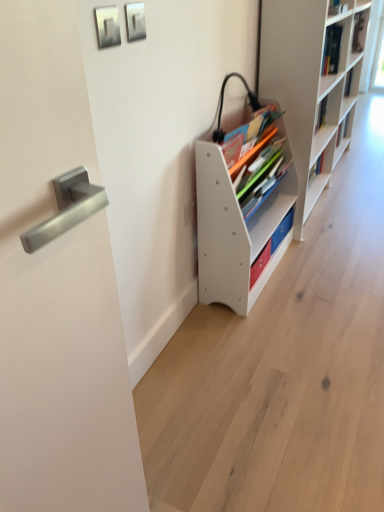
Image resolution: width=384 pixels, height=512 pixels. What do you see at coordinates (238, 224) in the screenshot? I see `white plastic shelf at center, marked as the 2th shelf in a right-to-left arrangement` at bounding box center [238, 224].

Describe the element at coordinates (57, 288) in the screenshot. I see `satin silver handle at left` at that location.

The image size is (384, 512). What do you see at coordinates (258, 166) in the screenshot? I see `matte white bookshelf at center` at bounding box center [258, 166].

Where is `white matte bookshelf at right, placed as the 1th shelf when sorted from right to left`? The width and height of the screenshot is (384, 512). white matte bookshelf at right, placed as the 1th shelf when sorted from right to left is located at coordinates (313, 83).

The height and width of the screenshot is (512, 384). What do you see at coordinates (313, 83) in the screenshot? I see `white matte bookshelf at right, placed as the 1th shelf when sorted from right to left` at bounding box center [313, 83].

Identify the location of metallic silver picture frame at upper center, which is the second picture frame from right to left. (107, 26).

Is the position of satin silver handle at left more distant than that of metallic silver picture frame at upper center, which is the second picture frame from right to left?

No, satin silver handle at left is closer to the viewer.

Does satin silver handle at left turn towards metallic silver picture frame at upper center, which is the second picture frame from right to left?

No, satin silver handle at left is not turned towards metallic silver picture frame at upper center, which is the second picture frame from right to left.

Is white plastic shelf at center, the 1th shelf viewed from the left, located within white matte bookshelf at right, the 2th shelf viewed from the left?

Definitely not — white plastic shelf at center, the 1th shelf viewed from the left, is not inside white matte bookshelf at right, the 2th shelf viewed from the left.

Which of these two, white matte bookshelf at right, placed as the 1th shelf when sorted from right to left, or white plastic shelf at center, the 1th shelf viewed from the left, is bigger?

white matte bookshelf at right, placed as the 1th shelf when sorted from right to left.

Is point (315, 186) closer to camera compared to point (284, 144)?

No, it is behind (284, 144).

Is white matte bookshelf at right, the 2th shelf viewed from the left, not near white plastic shelf at center, the 1th shelf viewed from the left?

No, white matte bookshelf at right, the 2th shelf viewed from the left, is in close proximity to white plastic shelf at center, the 1th shelf viewed from the left.

From a real-world perspective, which is physically below, white plastic shelf at center, the 1th shelf viewed from the left, or metallic silver picture frame at upper center, which is the second picture frame from right to left?

From a 3D spatial view, white plastic shelf at center, the 1th shelf viewed from the left, is below.

Considering the points (269, 269) and (113, 13), which point is behind, point (269, 269) or point (113, 13)?

The point (269, 269) is farther.

Where is `the 2nd shelf directly beneath the metallic silver picture frame at upper center, acting as the first picture frame starting from the left (from a real-world perspective)`? This screenshot has width=384, height=512. the 2nd shelf directly beneath the metallic silver picture frame at upper center, acting as the first picture frame starting from the left (from a real-world perspective) is located at coordinates (238, 224).

Is metallic silver picture frame at upper center, which is the second picture frame from right to left, surrounded by white plastic shelf at center, marked as the 2th shelf in a right-to-left arrangement?

Definitely not — metallic silver picture frame at upper center, which is the second picture frame from right to left, is not inside white plastic shelf at center, marked as the 2th shelf in a right-to-left arrangement.

Considering the positions of objects white matte bookshelf at right, the 2th shelf viewed from the left, and metallic silver picture frame at upper center, which is the second picture frame from right to left, in the image provided, who is in front, white matte bookshelf at right, the 2th shelf viewed from the left, or metallic silver picture frame at upper center, which is the second picture frame from right to left,?

metallic silver picture frame at upper center, which is the second picture frame from right to left, is more forward.

Where is `picture frame that is the 2nd object located in front of the white matte bookshelf at right, the 2th shelf viewed from the left`? This screenshot has width=384, height=512. picture frame that is the 2nd object located in front of the white matte bookshelf at right, the 2th shelf viewed from the left is located at coordinates (107, 26).

From a real-world perspective, between white matte bookshelf at right, the 2th shelf viewed from the left, and metallic silver picture frame at upper center, acting as the first picture frame starting from the left, who is vertically higher?

In real-world perspective, metallic silver picture frame at upper center, acting as the first picture frame starting from the left, is above.

Does white matte bookshelf at right, the 2th shelf viewed from the left, have a smaller size compared to metallic silver picture frame at upper center, acting as the first picture frame starting from the left?

Result: Incorrect, white matte bookshelf at right, the 2th shelf viewed from the left, is not smaller in size than metallic silver picture frame at upper center, acting as the first picture frame starting from the left.

From a real-world perspective, count 2nd picture frames upward from the matte white bookshelf at center and point to it. Please provide its 2D coordinates.

[(135, 21)]

Considering the sizes of objects matte white bookshelf at center and metallic silver picture frame at upper center, placed as the 2th picture frame when sorted from left to right, in the image provided, who is bigger, matte white bookshelf at center or metallic silver picture frame at upper center, placed as the 2th picture frame when sorted from left to right,?

Bigger between the two is matte white bookshelf at center.

Is matte white bookshelf at center completely or partially outside of metallic silver picture frame at upper center, placed as the 2th picture frame when sorted from left to right?

Yes, matte white bookshelf at center is not within metallic silver picture frame at upper center, placed as the 2th picture frame when sorted from left to right.

From a real-world perspective, which object rests below the other?

matte white bookshelf at center, from a real-world perspective.

Which object is closer to the camera, metallic silver picture frame at upper center, placed as the 2th picture frame when sorted from left to right, or white matte bookshelf at right, the 2th shelf viewed from the left?

metallic silver picture frame at upper center, placed as the 2th picture frame when sorted from left to right, is in front.

In the image, is metallic silver picture frame at upper center, placed as the 2th picture frame when sorted from left to right, on the left side or the right side of white matte bookshelf at right, the 2th shelf viewed from the left?

metallic silver picture frame at upper center, placed as the 2th picture frame when sorted from left to right, is to the left of white matte bookshelf at right, the 2th shelf viewed from the left.

Is metallic silver picture frame at upper center, placed as the 2th picture frame when sorted from left to right, facing away from white matte bookshelf at right, placed as the 1th shelf when sorted from right to left?

metallic silver picture frame at upper center, placed as the 2th picture frame when sorted from left to right, is not turned away from white matte bookshelf at right, placed as the 1th shelf when sorted from right to left.

Can you confirm if metallic silver picture frame at upper center, which is counted as the 1th picture frame, starting from the right, is shorter than white matte bookshelf at right, the 2th shelf viewed from the left?

Indeed, metallic silver picture frame at upper center, which is counted as the 1th picture frame, starting from the right, has a lesser height compared to white matte bookshelf at right, the 2th shelf viewed from the left.

Considering the sizes of white plastic shelf at center, marked as the 2th shelf in a right-to-left arrangement, and metallic silver picture frame at upper center, which is counted as the 1th picture frame, starting from the right, in the image, is white plastic shelf at center, marked as the 2th shelf in a right-to-left arrangement, taller or shorter than metallic silver picture frame at upper center, which is counted as the 1th picture frame, starting from the right,?

white plastic shelf at center, marked as the 2th shelf in a right-to-left arrangement, is taller than metallic silver picture frame at upper center, which is counted as the 1th picture frame, starting from the right.

From a real-world perspective, is white plastic shelf at center, the 1th shelf viewed from the left, positioned above or below metallic silver picture frame at upper center, placed as the 2th picture frame when sorted from left to right?

white plastic shelf at center, the 1th shelf viewed from the left, is situated lower than metallic silver picture frame at upper center, placed as the 2th picture frame when sorted from left to right, in the real world.

Is white plastic shelf at center, marked as the 2th shelf in a right-to-left arrangement, looking in the opposite direction of metallic silver picture frame at upper center, which is counted as the 1th picture frame, starting from the right?

That's not correct — white plastic shelf at center, marked as the 2th shelf in a right-to-left arrangement, is not looking away from metallic silver picture frame at upper center, which is counted as the 1th picture frame, starting from the right.

Is white plastic shelf at center, the 1th shelf viewed from the left, far from metallic silver picture frame at upper center, placed as the 2th picture frame when sorted from left to right?

No, white plastic shelf at center, the 1th shelf viewed from the left, is not far away from metallic silver picture frame at upper center, placed as the 2th picture frame when sorted from left to right.

From the image's perspective, count 1st picture frames upward from the satin silver handle at left and point to it. Please provide its 2D coordinates.

[(107, 26)]

Identify the location of shelf lying below the white matte bookshelf at right, the 2th shelf viewed from the left (from the image's perspective). This screenshot has width=384, height=512. (238, 224).

Looking at the image, which one is located closer to metallic silver picture frame at upper center, acting as the first picture frame starting from the left, metallic silver picture frame at upper center, placed as the 2th picture frame when sorted from left to right, or matte white bookshelf at center?

metallic silver picture frame at upper center, placed as the 2th picture frame when sorted from left to right, is positioned closer to the anchor metallic silver picture frame at upper center, acting as the first picture frame starting from the left.

Which object lies nearer to the anchor point matte white bookshelf at center, white matte bookshelf at right, placed as the 1th shelf when sorted from right to left, or metallic silver picture frame at upper center, which is the second picture frame from right to left?

Among the two, white matte bookshelf at right, placed as the 1th shelf when sorted from right to left, is located nearer to matte white bookshelf at center.

Looking at the image, which one is located further to white matte bookshelf at right, placed as the 1th shelf when sorted from right to left, white plastic shelf at center, marked as the 2th shelf in a right-to-left arrangement, or metallic silver picture frame at upper center, which is the second picture frame from right to left?

metallic silver picture frame at upper center, which is the second picture frame from right to left, is further to white matte bookshelf at right, placed as the 1th shelf when sorted from right to left.

Looking at the image, which one is located further to metallic silver picture frame at upper center, which is the second picture frame from right to left, satin silver handle at left or metallic silver picture frame at upper center, placed as the 2th picture frame when sorted from left to right?

Based on the image, satin silver handle at left appears to be further to metallic silver picture frame at upper center, which is the second picture frame from right to left.

Which object lies nearer to the anchor point metallic silver picture frame at upper center, which is counted as the 1th picture frame, starting from the right, white matte bookshelf at right, the 2th shelf viewed from the left, or satin silver handle at left?

satin silver handle at left is closer to metallic silver picture frame at upper center, which is counted as the 1th picture frame, starting from the right.

Based on their spatial positions, is metallic silver picture frame at upper center, which is the second picture frame from right to left, or white plastic shelf at center, the 1th shelf viewed from the left, closer to matte white bookshelf at center?

white plastic shelf at center, the 1th shelf viewed from the left, lies closer to matte white bookshelf at center than the other object.

From the image, which object appears to be farther from white matte bookshelf at right, the 2th shelf viewed from the left, metallic silver picture frame at upper center, which is the second picture frame from right to left, or matte white bookshelf at center?

Among the two, metallic silver picture frame at upper center, which is the second picture frame from right to left, is located further to white matte bookshelf at right, the 2th shelf viewed from the left.

Looking at the image, which one is located further to metallic silver picture frame at upper center, which is counted as the 1th picture frame, starting from the right, metallic silver picture frame at upper center, which is the second picture frame from right to left, or matte white bookshelf at center?

Based on the image, matte white bookshelf at center appears to be further to metallic silver picture frame at upper center, which is counted as the 1th picture frame, starting from the right.

I want to click on shelf situated between metallic silver picture frame at upper center, acting as the first picture frame starting from the left, and white matte bookshelf at right, the 2th shelf viewed from the left, from left to right, so click(238, 224).

At what (x,y) coordinates should I click in order to perform the action: click on shelf located between metallic silver picture frame at upper center, which is counted as the 1th picture frame, starting from the right, and matte white bookshelf at center in the depth direction. Please return your answer as a coordinate pair (x, y). Looking at the image, I should click on (238, 224).

The width and height of the screenshot is (384, 512). Find the location of `shelf between metallic silver picture frame at upper center, which is counted as the 1th picture frame, starting from the right, and white matte bookshelf at right, the 2th shelf viewed from the left, in the horizontal direction`. shelf between metallic silver picture frame at upper center, which is counted as the 1th picture frame, starting from the right, and white matte bookshelf at right, the 2th shelf viewed from the left, in the horizontal direction is located at coordinates (238, 224).

Identify the location of book between metallic silver picture frame at upper center, which is counted as the 1th picture frame, starting from the right, and white matte bookshelf at right, the 2th shelf viewed from the left, in the horizontal direction. (258, 166).